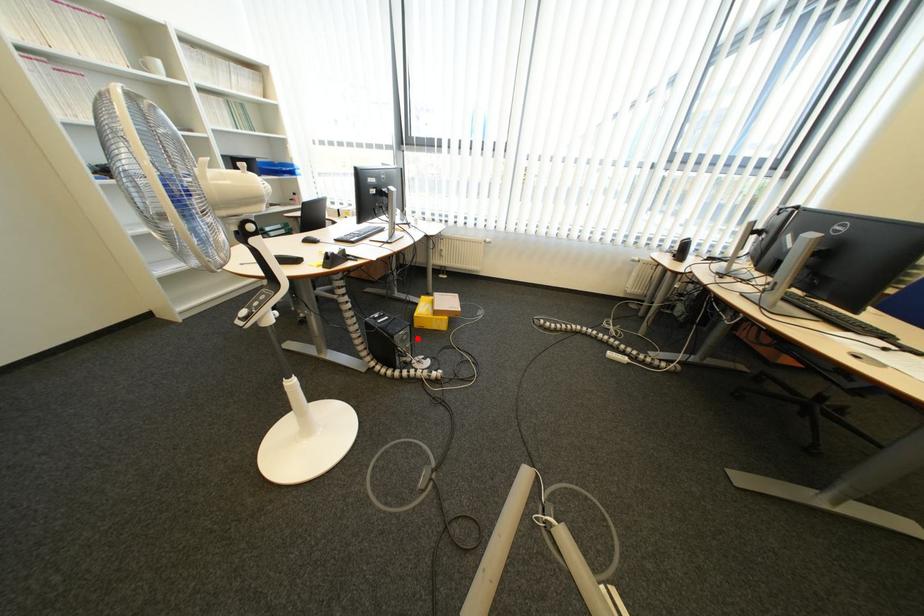
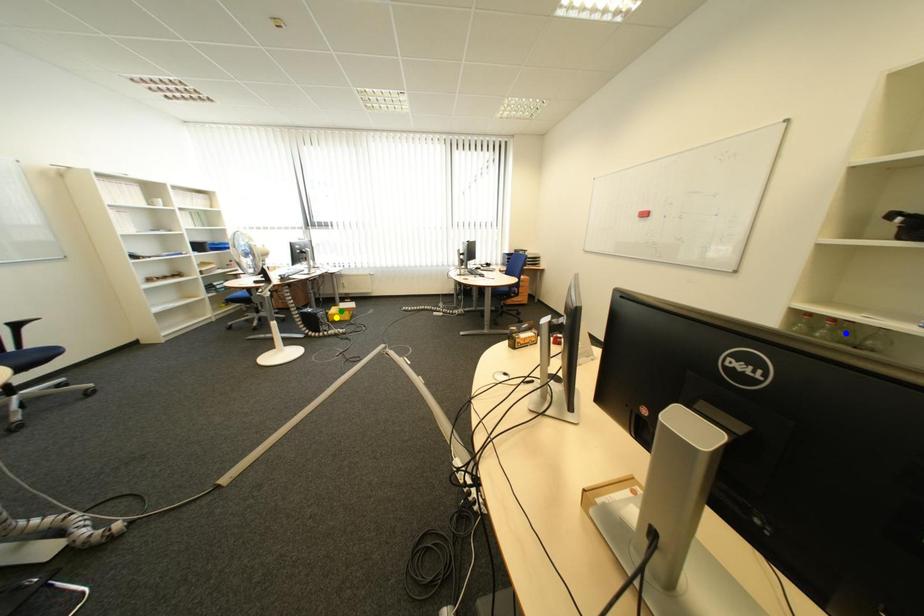
Question: I am providing you with two images of the same scene from different viewpoints. A red point is marked on the first image. You are given multiple points on the second image. Can you choose the point in image 2 that corresponds to the point in image 1?

Choices:
 (A) blue point
 (B) green point
 (C) yellow point

Answer: (C)